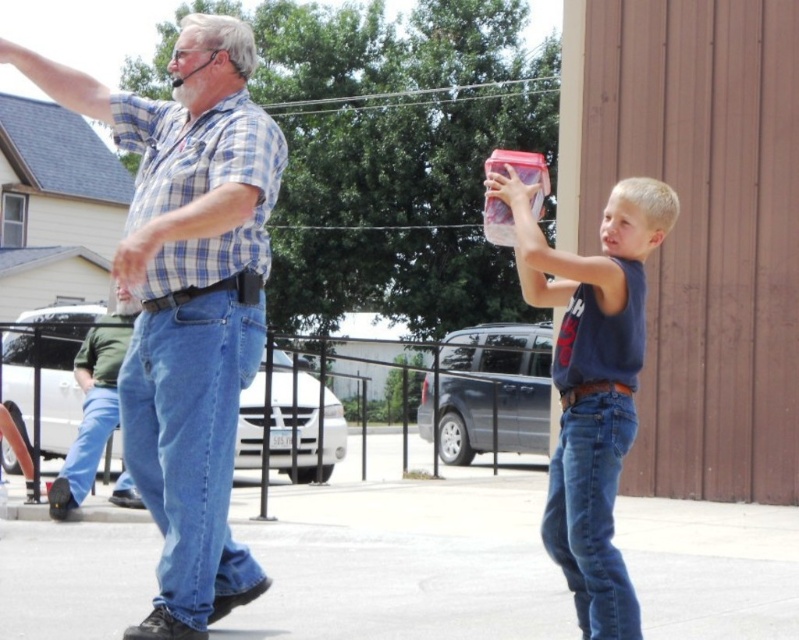
You are a photographer trying to capture the blue plaid shirt at upper left in the center of your camera frame. Given its current position at point 0.469 on the x axis and 0.237 on the y axis, which direction should you move your camera to center it? Please specify left, right, up, or down.

The blue plaid shirt at upper left is located at coordinates x 0.469 and y 0.237. To center it, move the camera right if the x value is less than 0.5 and up if the y value is less than 0.5. Since x is 0.469 < 0.5, move right. Y is 0.237 < 0.5, so move up. Therefore, move the camera right and up to center the blue plaid shirt at upper left.

You are standing at the center of the parking lot and see the blue plaid shirt at upper left. In which direction should you move to get closer to it?

The blue plaid shirt at upper left is located at point (189, 300), so you should move towards the upper left direction to get closer to it.

You are a photographer trying to capture both the blue plaid shirt at upper left and the matte plastic container at center in a single frame. Based on their sizes in the image, which object should you focus on first to ensure both are in focus?

The blue plaid shirt at upper left is much taller than the matte plastic container at center, so focusing on the blue plaid shirt at upper left first would help ensure both are in focus since it is larger and likely closer to the camera.